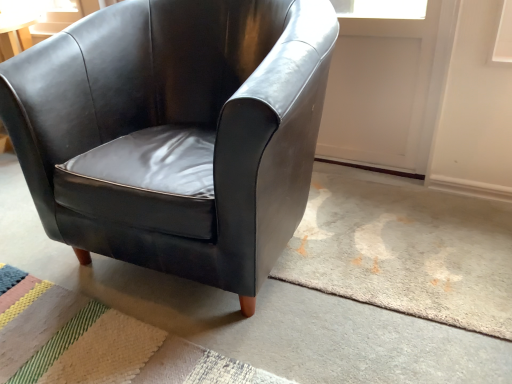
Question: Based on their positions, is matte black armchair at center located to the left or right of matte black armchair at center?

Choices:
 (A) left
 (B) right

Answer: (B)

Question: From the image's perspective, is matte black armchair at center above or below matte black armchair at center?

Choices:
 (A) below
 (B) above

Answer: (B)

Question: Estimate the real-world distances between objects in this image. Which object is farther from the textured beige rug at lower left?

Choices:
 (A) matte black armchair at center
 (B) matte black armchair at center

Answer: (A)

Question: Estimate the real-world distances between objects in this image. Which object is farther from the textured beige rug at lower left?

Choices:
 (A) matte black armchair at center
 (B) matte black armchair at center

Answer: (B)